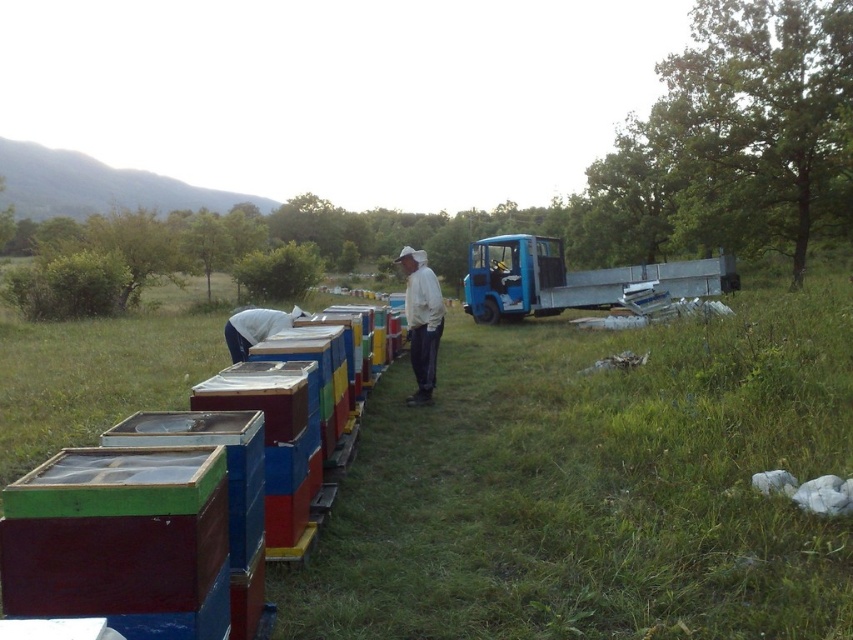
You are a photographer trying to capture both the white matte jacket at center and the white fabric at center in the same frame. Since both are white, you need to adjust your camera settings to ensure they are distinguishable. Which object should you focus on first to ensure proper exposure, considering their sizes?

The white matte jacket at center is narrower than the white fabric at center, so focusing on the smaller white matte jacket at center first would allow you to adjust exposure for its details before ensuring the white fabric at center is also properly lit.

You are a photographer standing at the edge of the grassy field. You want to take a photo of the multicolored painted beehive at center and the white matte jacket at center so that both are clearly visible. Based on their heights, will the jacket block the view of the beehive in the photo?

The multicolored painted beehive at center is shorter than the white matte jacket at center. Since the jacket is taller, it might block part of the beehive in the photo if they are positioned close to each other in the frame.